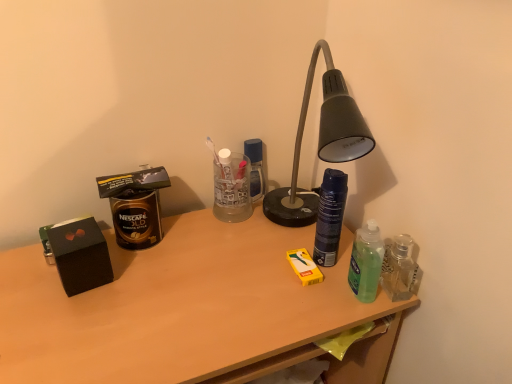
Locate an element on the screen. This screenshot has width=512, height=384. unoccupied space behind dark blue matte spray can at center, positioned as the 1th bottle in left-to-right order is located at coordinates (294, 220).